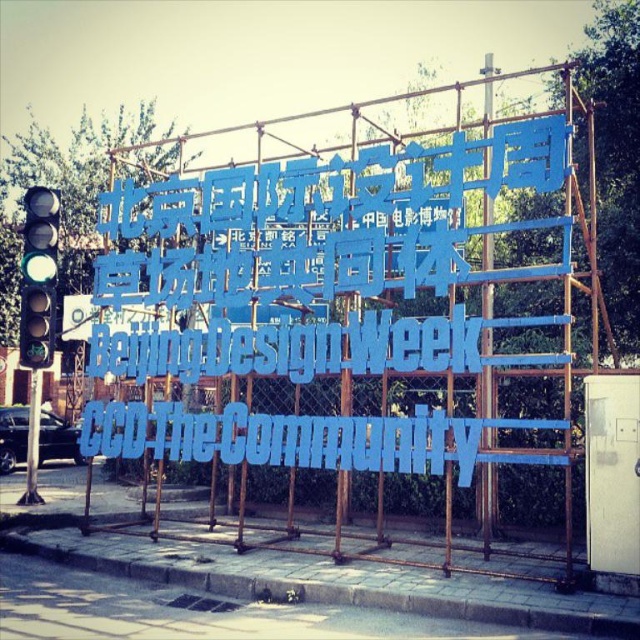
Who is shorter, blue plastic letters at center or green matte traffic light at left?

blue plastic letters at center is shorter.

Is blue plastic letters at center wider than green matte traffic light at left?

Correct, the width of blue plastic letters at center exceeds that of green matte traffic light at left.

Which is in front, point (406, 438) or point (35, 228)?

Point (406, 438) is in front.

Identify the location of blue plastic letters at center. (282, 438).

Does blue plastic letters at center appear on the right side of blue plastic text at center?

In fact, blue plastic letters at center is to the left of blue plastic text at center.

Where is `blue plastic letters at center`? Image resolution: width=640 pixels, height=640 pixels. blue plastic letters at center is located at coordinates (282, 438).

Is point (141, 433) more distant than point (116, 369)?

No.

Where is `blue plastic letters at center`? Image resolution: width=640 pixels, height=640 pixels. blue plastic letters at center is located at coordinates (282, 438).

The height and width of the screenshot is (640, 640). What do you see at coordinates (291, 348) in the screenshot?
I see `blue plastic text at center` at bounding box center [291, 348].

Is blue plastic text at center closer to the viewer compared to green matte traffic light at left?

Yes, it is.

Image resolution: width=640 pixels, height=640 pixels. In order to click on blue plastic text at center in this screenshot , I will do `click(291, 348)`.